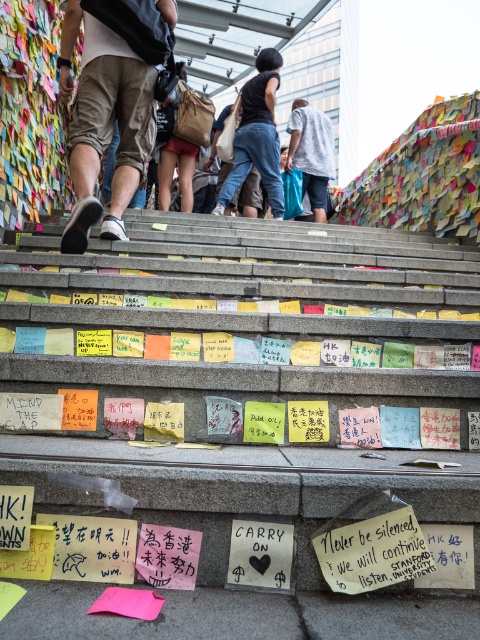
Question: Considering the real-world distances, which object is farthest from the white cotton shirt at upper center?

Choices:
 (A) khaki cotton shorts at lower left
 (B) black matte tank top at center

Answer: (A)

Question: Where is khaki cotton shorts at lower left located in relation to white cotton shirt at upper center in the image?

Choices:
 (A) below
 (B) above

Answer: (A)

Question: Considering the real-world distances, which object is farthest from the khaki cotton shorts at lower left?

Choices:
 (A) black matte tank top at center
 (B) brown canvas bag at center
 (C) white cotton shirt at upper center

Answer: (C)

Question: Is khaki cotton shorts at lower left below black matte tank top at center?

Choices:
 (A) no
 (B) yes

Answer: (B)

Question: Where is black matte tank top at center located in relation to white cotton shirt at upper center in the image?

Choices:
 (A) below
 (B) above

Answer: (B)

Question: Which of the following is the closest to the observer?

Choices:
 (A) khaki cotton shorts at lower left
 (B) brown canvas bag at center

Answer: (A)